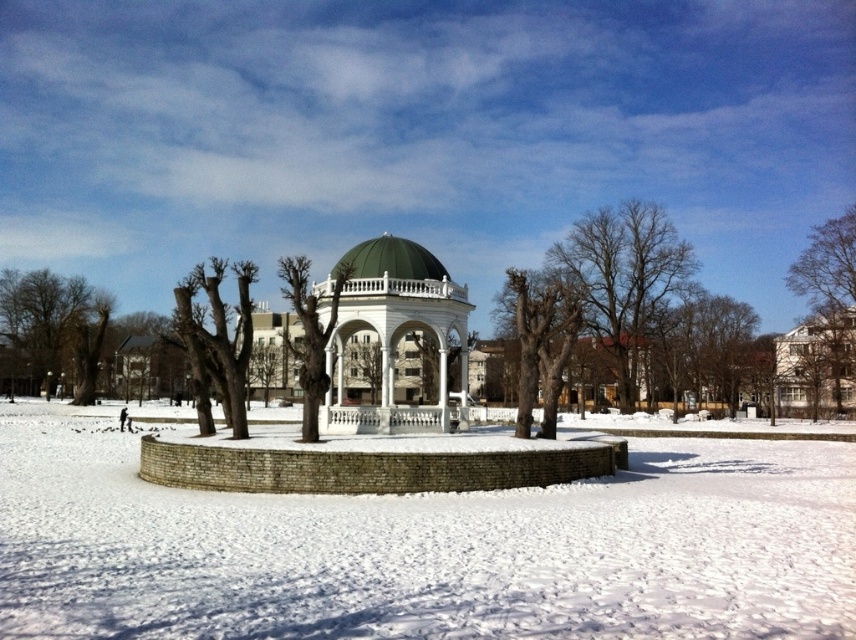
From the picture: You are standing at the center of the gazebo and want to place a small decorative snowman exactly at the center of the white powdery snow at center. According to the coordinates provided, where should you place the snowman?

The white powdery snow at center is located at coordinates point (426, 548), so you should place the snowman at point (426, 548).

You are standing in the snowy park and want to take a photo of the white gazebo with green dome roof. You notice two points marked in the scene at coordinates point (x=538, y=380) and point (x=316, y=356). Which point is closer to your camera position?

Point (x=316, y=356) is closer to the camera position because the description states that point (x=538, y=380) is further away from the camera than point (x=316, y=356).

You are planning to hang a bird feeder from the highest point in the image. Which object should you choose between the bare wood tree at upper right and the green dome at center?

The bare wood tree at upper right is much taller than the green dome at center, so you should hang the bird feeder from the bare wood tree at upper right.